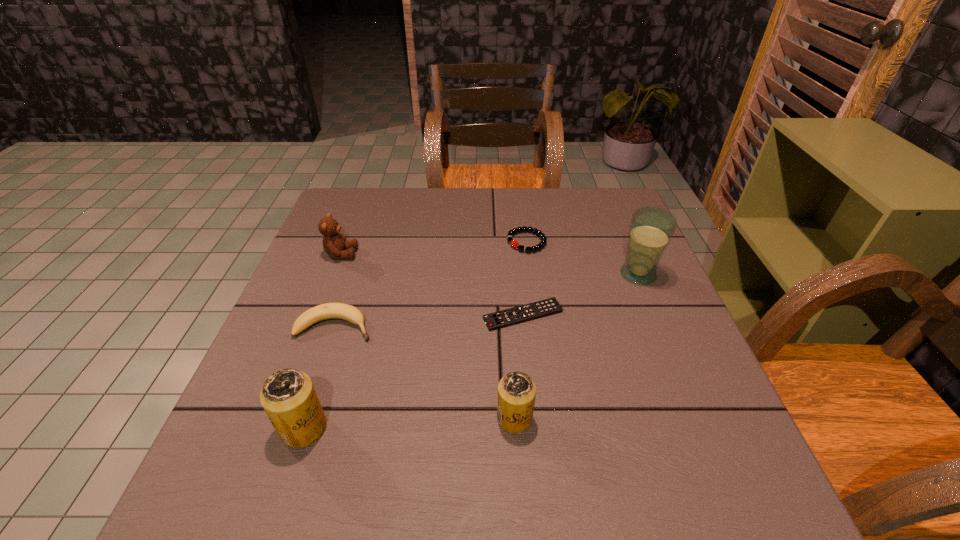
The image size is (960, 540). I want to click on free space located 0.130m on the back of the shorter beer can, so click(510, 349).

Locate an element on the screen. This screenshot has width=960, height=540. free region located 0.100m on the back of the bracelet is located at coordinates (522, 211).

I want to click on free location located on the face of the teddy bear, so click(x=429, y=254).

This screenshot has height=540, width=960. I want to click on free space located 0.050m on the front of the rightmost object, so click(x=649, y=302).

Locate an element on the screen. vacant space situated at the stem of the banana is located at coordinates (528, 326).

This screenshot has width=960, height=540. Find the location of `vacant space situated on the front of the shortest object`. vacant space situated on the front of the shortest object is located at coordinates (531, 390).

Locate an element on the screen. object at the far edge is located at coordinates (513, 243).

Where is `beer can at the left edge`? The width and height of the screenshot is (960, 540). beer can at the left edge is located at coordinates (288, 396).

At what (x,y) coordinates should I click in order to perform the action: click on teddy bear that is positioned at the left edge. Please return your answer as a coordinate pair (x, y). The height and width of the screenshot is (540, 960). Looking at the image, I should click on (335, 245).

You are a GUI agent. You are given a task and a screenshot of the screen. Output one action in this format:
    pyautogui.click(x=<x>, y=<y>)
    Task: Click on the banana at the left edge
    The height and width of the screenshot is (540, 960).
    Given the screenshot: What is the action you would take?
    pyautogui.click(x=325, y=311)